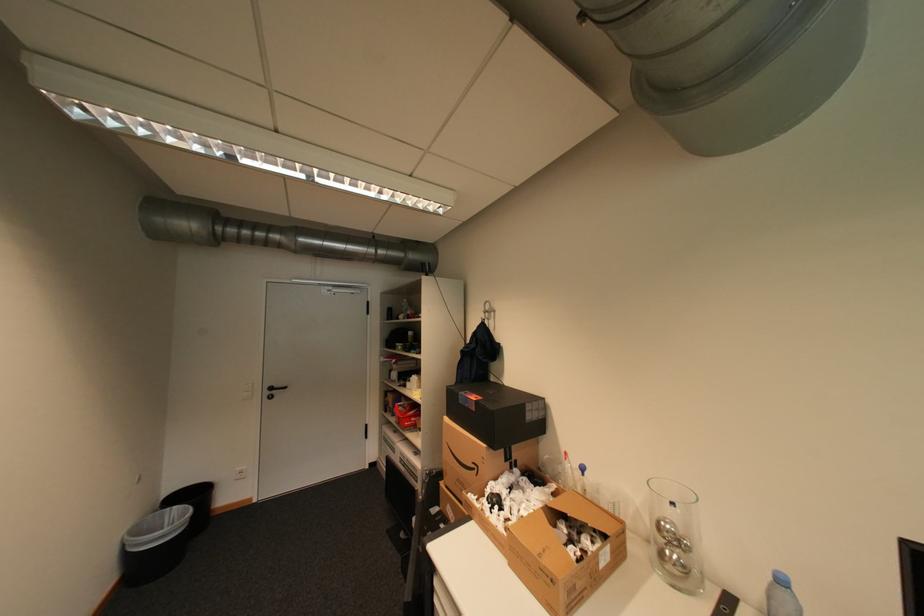
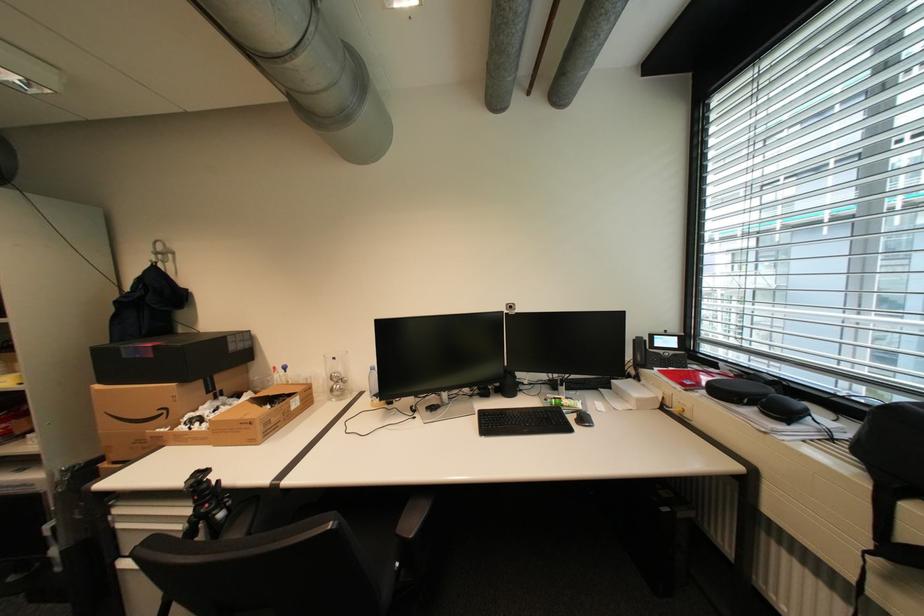
Locate, in the second image, the point that corresponds to point 484,468 in the first image.

(174, 411)